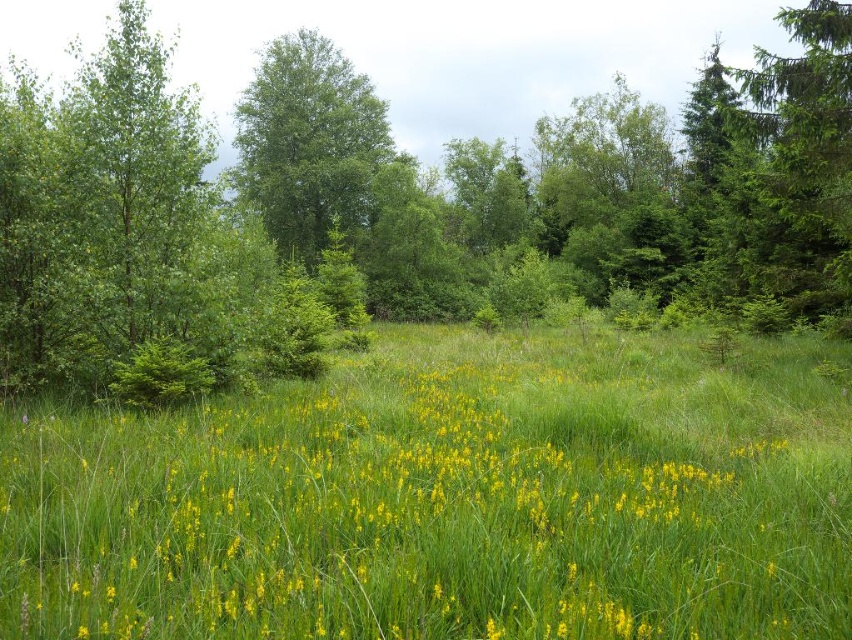
Is green leafy tree at upper center to the left of green leafy tree at center from the viewer's perspective?

No, green leafy tree at upper center is not to the left of green leafy tree at center.

Describe the element at coordinates (401, 202) in the screenshot. The height and width of the screenshot is (640, 852). I see `green leafy tree at upper center` at that location.

Is point (137, 314) closer to viewer compared to point (314, 100)?

Yes, it is in front of point (314, 100).

The width and height of the screenshot is (852, 640). What are the coordinates of `green leafy tree at upper center` in the screenshot? It's located at (401, 202).

Can you confirm if green leafy tree at upper center is smaller than yellow grass at center?

No, green leafy tree at upper center is not smaller than yellow grass at center.

In the scene shown: Can you confirm if green leafy tree at upper center is positioned above yellow grass at center?

Indeed, green leafy tree at upper center is positioned over yellow grass at center.

At what (x,y) coordinates should I click in order to perform the action: click on green leafy tree at upper center. Please return your answer as a coordinate pair (x, y). Image resolution: width=852 pixels, height=640 pixels. Looking at the image, I should click on (401, 202).

Is yellow grass at center to the right of green leafy tree at center from the viewer's perspective?

Correct, you'll find yellow grass at center to the right of green leafy tree at center.

Can you confirm if yellow grass at center is positioned to the left of green leafy tree at center?

No, yellow grass at center is not to the left of green leafy tree at center.

Which is behind, point (476, 552) or point (358, 90)?

The point (358, 90) is behind.

What are the coordinates of `yellow grass at center` in the screenshot? It's located at (401, 515).